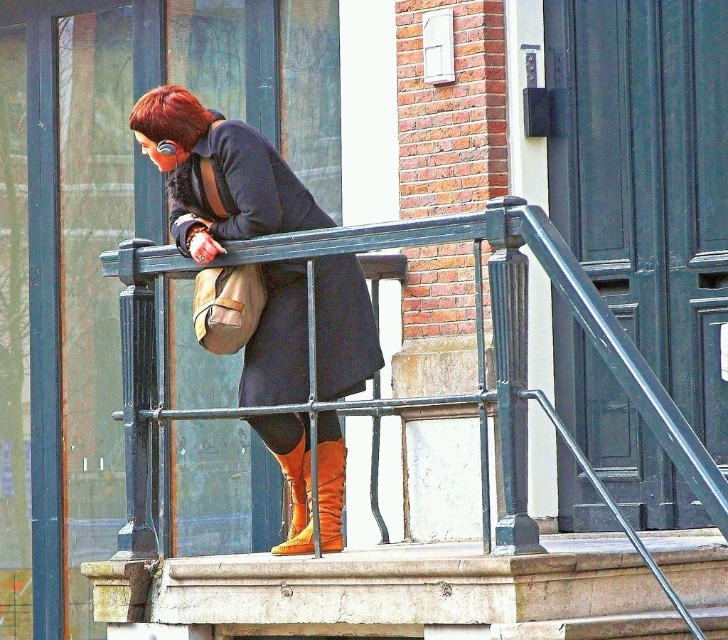
Is matte black coat at center taller than orange suede boot at lower center?

Correct, matte black coat at center is much taller as orange suede boot at lower center.

Looking at this image, which is above, matte black coat at center or orange suede boot at lower center?

matte black coat at center is above.

Where is `matte black coat at center`? This screenshot has height=640, width=728. matte black coat at center is located at coordinates (218, 176).

Does black metal balustrade at center have a lesser width compared to orange suede boot at center?

In fact, black metal balustrade at center might be wider than orange suede boot at center.

Who is more distant from viewer, (553, 580) or (293, 500)?

The point (293, 500) is more distant.

Locate an element on the screen. The image size is (728, 640). black metal balustrade at center is located at coordinates (397, 545).

Can you confirm if matte black coat at center is taller than shiny brown hair at upper left?

Correct, matte black coat at center is much taller as shiny brown hair at upper left.

The width and height of the screenshot is (728, 640). What do you see at coordinates (218, 176) in the screenshot? I see `matte black coat at center` at bounding box center [218, 176].

Image resolution: width=728 pixels, height=640 pixels. Identify the location of matte black coat at center. (218, 176).

Image resolution: width=728 pixels, height=640 pixels. In order to click on matte black coat at center in this screenshot , I will do `click(218, 176)`.